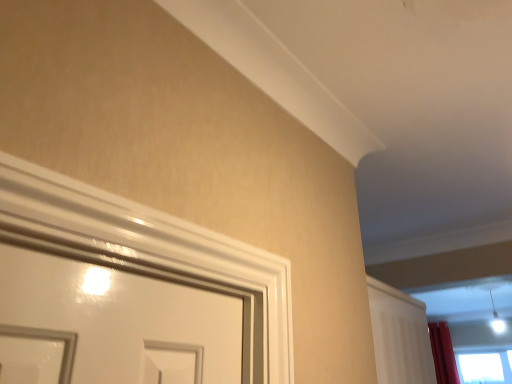
Describe the element at coordinates (443, 354) in the screenshot. This screenshot has width=512, height=384. I see `velvet red curtain at lower right` at that location.

The width and height of the screenshot is (512, 384). In order to click on velvet red curtain at lower right in this screenshot , I will do `click(443, 354)`.

Image resolution: width=512 pixels, height=384 pixels. I want to click on velvet red curtain at lower right, so click(443, 354).